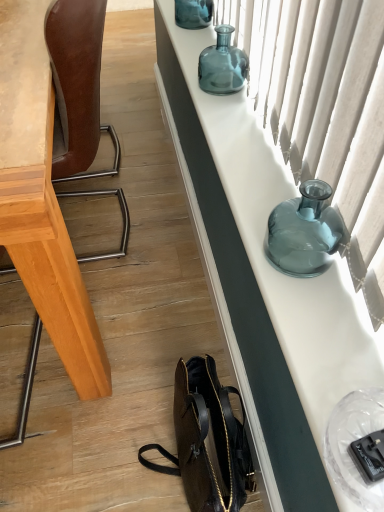
Locate an element on the screen. Image resolution: width=384 pixels, height=512 pixels. free space to the left of brown leather handbag at lower center is located at coordinates (145, 458).